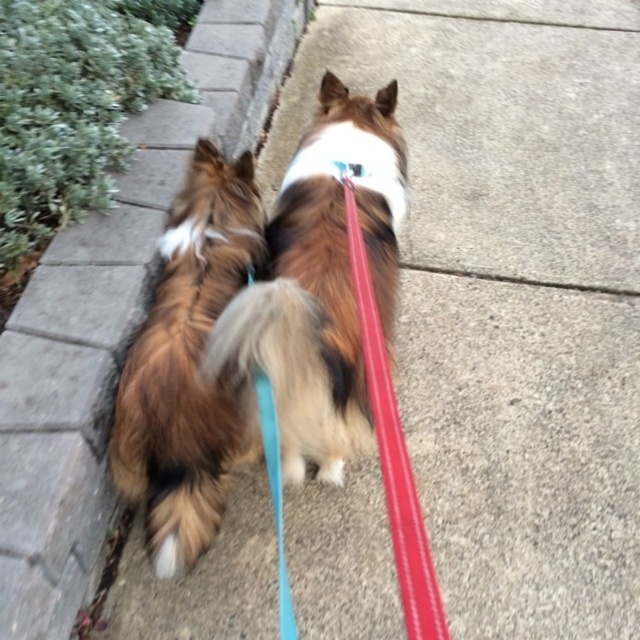
From the picture: You are a dog owner holding a leash that is 70 centimeters long. You see the rubberized red leash at center. Can you reach it without moving your position?

The distance between the rubberized red leash at center and the viewer is 75.43 centimeters, which is longer than the 70 centimeter leash you have. Therefore, you cannot reach the rubberized red leash at center with your current leash length.

You are a dog owner who wants to ensure your brown fluffy dog at left has a properly fitting collar. Based on the image, does the blue fabric collar at upper center seem to fit the dog?

The brown fluffy dog at left is bigger than the blue fabric collar at upper center, so the collar may be too small to fit the dog properly.

You are a photographer standing behind two dogs on a sidewalk. You want to take a photo focusing on the point closer to you. Which point should you aim for, point (227, 337) or point (349, 163)?

Point (227, 337) is closer to the viewer than point (349, 163), so you should aim for point (227, 337).